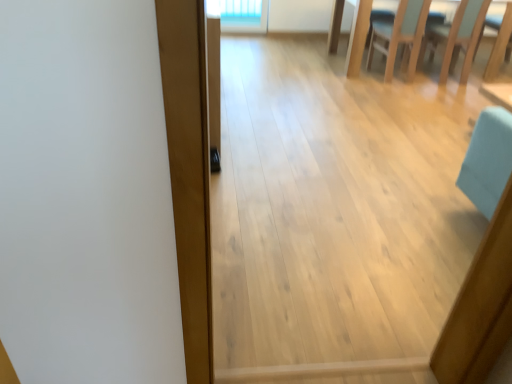
Find the location of a particular element. This screenshot has width=512, height=384. light wood chair at upper right is located at coordinates (400, 36).

Image resolution: width=512 pixels, height=384 pixels. Describe the element at coordinates (457, 36) in the screenshot. I see `light blue fabric chair at upper right` at that location.

This screenshot has width=512, height=384. Identify the location of light wood chair at upper right. (400, 36).

In the scene shown: Is light brown wood plank at center not near light blue fabric chair at upper right?

That's right, there is a large distance between light brown wood plank at center and light blue fabric chair at upper right.

Is point (197, 119) behind point (465, 28)?

No, it is in front of (465, 28).

Image resolution: width=512 pixels, height=384 pixels. In order to click on plank that is on the left side of light blue fabric chair at upper right in this screenshot , I will do `click(189, 171)`.

Is light brown wood plank at center at the left side of light blue fabric chair at upper right?

Yes.

Does light wood chair at upper right have a lesser height compared to light blue fabric chair at upper right?

Indeed, light wood chair at upper right has a lesser height compared to light blue fabric chair at upper right.

Considering the relative sizes of light wood chair at upper right and light blue fabric chair at upper right in the image provided, is light wood chair at upper right wider than light blue fabric chair at upper right?

Yes, light wood chair at upper right is wider than light blue fabric chair at upper right.

Which object is positioned more to the right, light wood chair at upper right or light blue fabric chair at upper right?

light blue fabric chair at upper right.

Identify the location of armchair on the right of light wood chair at upper right. (457, 36).

From the picture: Is there a large distance between light blue fabric chair at upper right and light wood chair at upper right?

No, light blue fabric chair at upper right is in close proximity to light wood chair at upper right.

Does light blue fabric chair at upper right have a greater height compared to light wood chair at upper right?

Yes, light blue fabric chair at upper right is taller than light wood chair at upper right.

Does light blue fabric chair at upper right lie behind light wood chair at upper right?

Yes, light blue fabric chair at upper right is behind light wood chair at upper right.

Consider the image. Does light wood chair at upper right have a smaller size compared to light brown wood plank at center?

Incorrect, light wood chair at upper right is not smaller in size than light brown wood plank at center.

From a real-world perspective, which object rests below the other?

light wood chair at upper right.

Does light wood chair at upper right appear on the right side of light brown wood plank at center?

Yes, light wood chair at upper right is to the right of light brown wood plank at center.

Is the surface of light wood chair at upper right in direct contact with light brown wood plank at center?

There is a gap between light wood chair at upper right and light brown wood plank at center.

Which point is more distant from viewer, (443,42) or (207,245)?

The point (443,42) is farther.

Can you confirm if light blue fabric chair at upper right is wider than light brown wood plank at center?

Correct, the width of light blue fabric chair at upper right exceeds that of light brown wood plank at center.

From the image's perspective, which is above, light blue fabric chair at upper right or light brown wood plank at center?

light blue fabric chair at upper right, from the image's perspective.

How distant is light blue fabric chair at upper right from light brown wood plank at center?

A distance of 3.89 meters exists between light blue fabric chair at upper right and light brown wood plank at center.

From a real-world perspective, is light brown wood plank at center located higher than light wood chair at upper right?

Yes, from a real-world perspective, light brown wood plank at center is above light wood chair at upper right.

Is light brown wood plank at center wider or thinner than light wood chair at upper right?

Considering their sizes, light brown wood plank at center looks slimmer than light wood chair at upper right.

Is light brown wood plank at center directly adjacent to light wood chair at upper right?

They are not placed beside each other.

Can you tell me how much light brown wood plank at center and light wood chair at upper right differ in facing direction?

75.5 degrees separate the facing orientations of light brown wood plank at center and light wood chair at upper right.

Locate an element on the screen. The height and width of the screenshot is (384, 512). armchair located behind the light brown wood plank at center is located at coordinates (457, 36).

This screenshot has height=384, width=512. There is a light wood chair at upper right. In order to click on armchair above it (from a real-world perspective) in this screenshot , I will do `click(457, 36)`.

Looking at this image, estimate the real-world distances between objects in this image. Which object is further from light wood chair at upper right, light brown wood plank at center or light blue fabric chair at upper right?

light brown wood plank at center lies further to light wood chair at upper right than the other object.

From the picture: Considering their positions, is light blue fabric chair at upper right positioned further to light brown wood plank at center than light wood chair at upper right?

light blue fabric chair at upper right is positioned further to the anchor light brown wood plank at center.

Which object lies further to the anchor point light wood chair at upper right, light blue fabric chair at upper right or light brown wood plank at center?

The object further to light wood chair at upper right is light brown wood plank at center.

Estimate the real-world distances between objects in this image. Which object is further from light brown wood plank at center, light wood chair at upper right or light blue fabric chair at upper right?

light blue fabric chair at upper right lies further to light brown wood plank at center than the other object.

Based on their spatial positions, is light brown wood plank at center or light wood chair at upper right further from light blue fabric chair at upper right?

light brown wood plank at center is positioned further to the anchor light blue fabric chair at upper right.

Consider the image. Considering their positions, is light wood chair at upper right positioned closer to light blue fabric chair at upper right than light brown wood plank at center?

light wood chair at upper right is positioned closer to the anchor light blue fabric chair at upper right.

What are the coordinates of `chair between light brown wood plank at center and light blue fabric chair at upper right from front to back` in the screenshot? It's located at (400, 36).